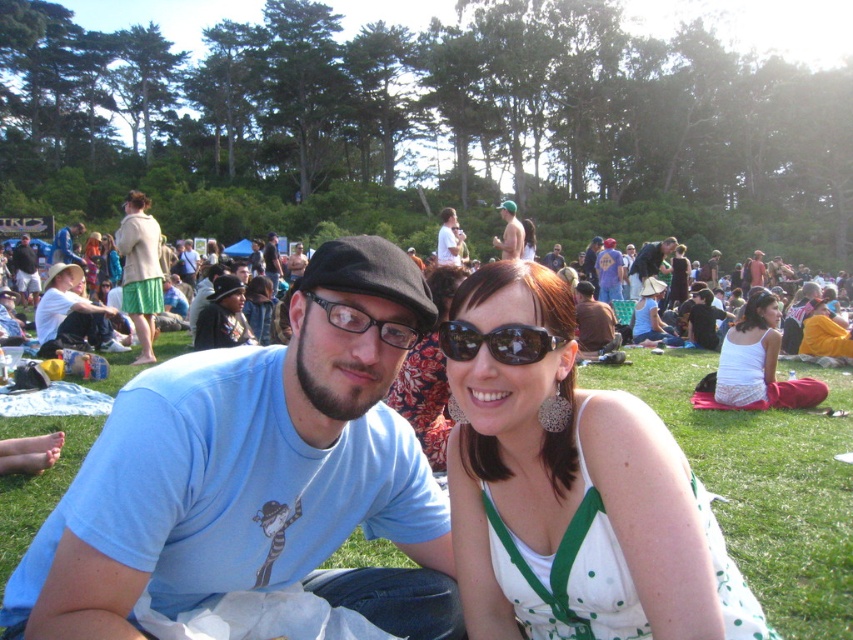
Question: Among these points, which one is farthest from the camera?

Choices:
 (A) (109, 248)
 (B) (512, 211)
 (C) (389, 365)
 (D) (229, 321)

Answer: (A)

Question: Can you confirm if matte black glasses at center is wider than matte blue t-shirt at center?

Choices:
 (A) yes
 (B) no

Answer: (B)

Question: Which object is closer to the camera taking this photo?

Choices:
 (A) black reflective sunglasses at center
 (B) brown leather jacket at center
 (C) matte white tank top at center
 (D) matte beige jacket at upper left

Answer: (A)

Question: Which object appears closest to the camera in this image?

Choices:
 (A) floral fabric dress at center
 (B) white lace tank top at center
 (C) black reflective sunglasses at center

Answer: (C)

Question: Is brown leather jacket at center to the left of blue t-shirt at center from the viewer's perspective?

Choices:
 (A) yes
 (B) no

Answer: (A)

Question: Considering the relative positions of green grass at center and white lace tank top at center in the image provided, where is green grass at center located with respect to white lace tank top at center?

Choices:
 (A) right
 (B) left

Answer: (B)